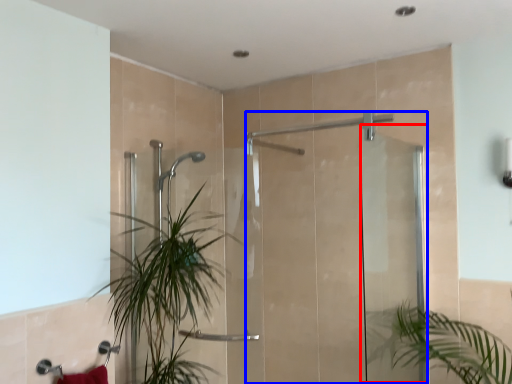
Question: Which object is closer to the camera taking this photo, screen door (highlighted by a red box) or screen door (highlighted by a blue box)?

Choices:
 (A) screen door
 (B) screen door

Answer: (A)